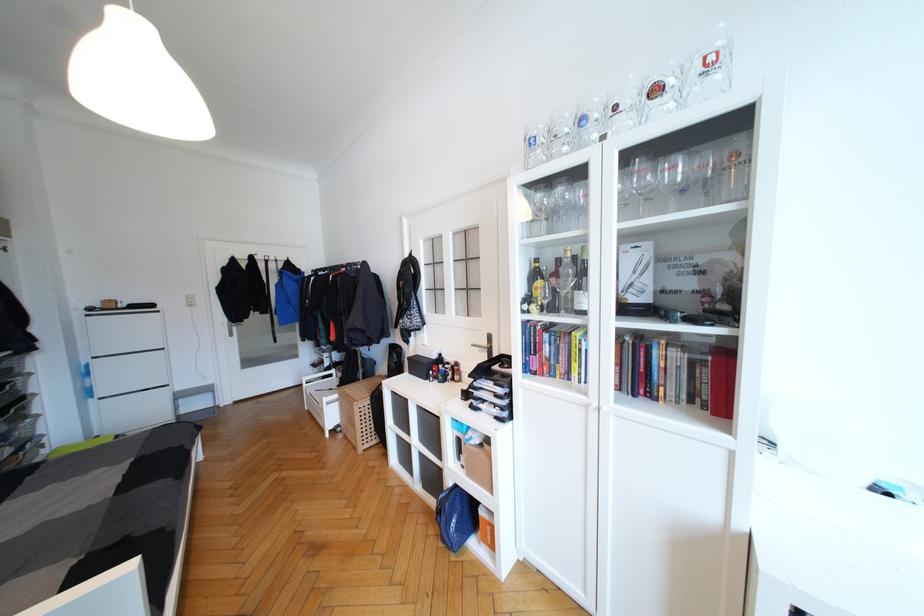
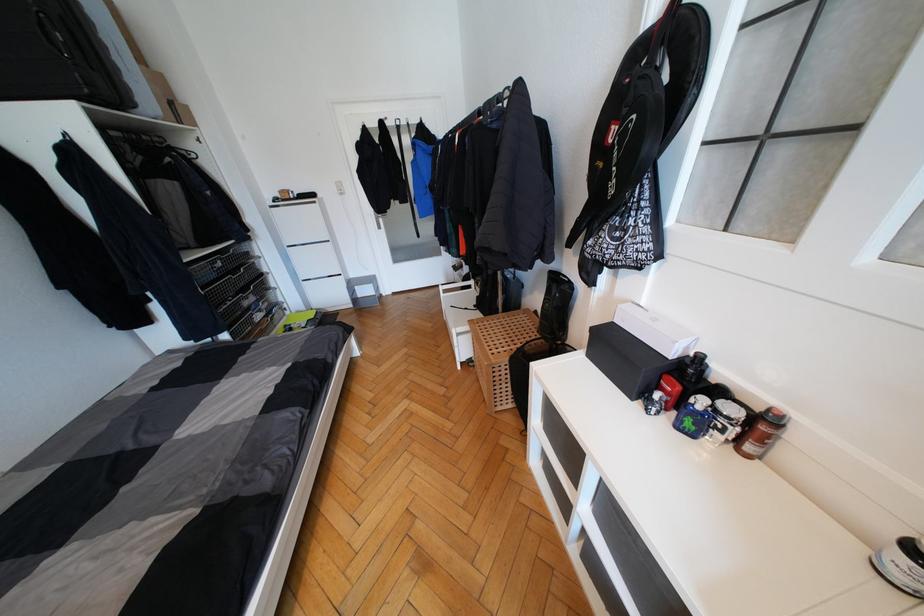
In the second image, find the point that corresponds to point 444,379 in the first image.

(691, 426)